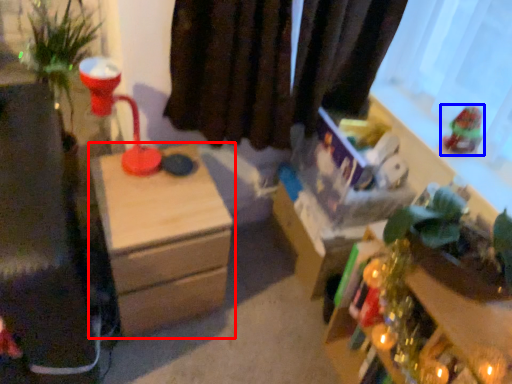
Question: Which of the following is the farthest to the observer, nightstand (highlighted by a red box) or toy (highlighted by a blue box)?

Choices:
 (A) nightstand
 (B) toy

Answer: (B)